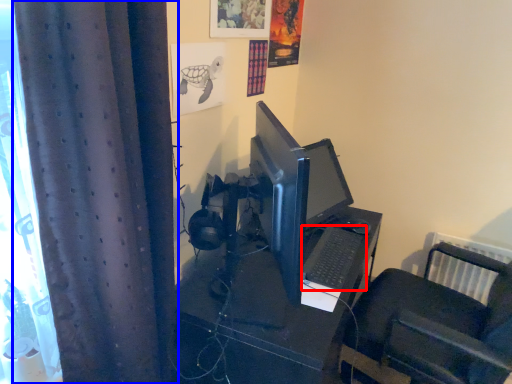
Question: Which point is further to the camera, computer keyboard (highlighted by a red box) or curtain (highlighted by a blue box)?

Choices:
 (A) computer keyboard
 (B) curtain

Answer: (A)